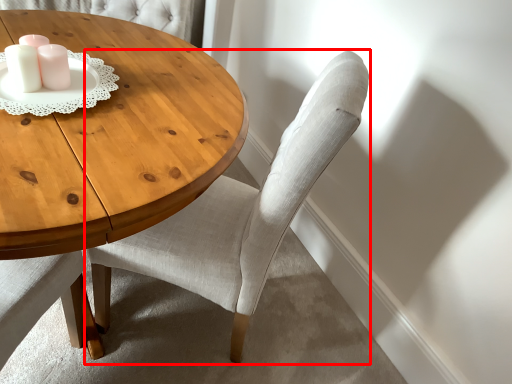
Question: In this image, where is chair (annotated by the red box) located relative to candle holder?

Choices:
 (A) left
 (B) right

Answer: (B)